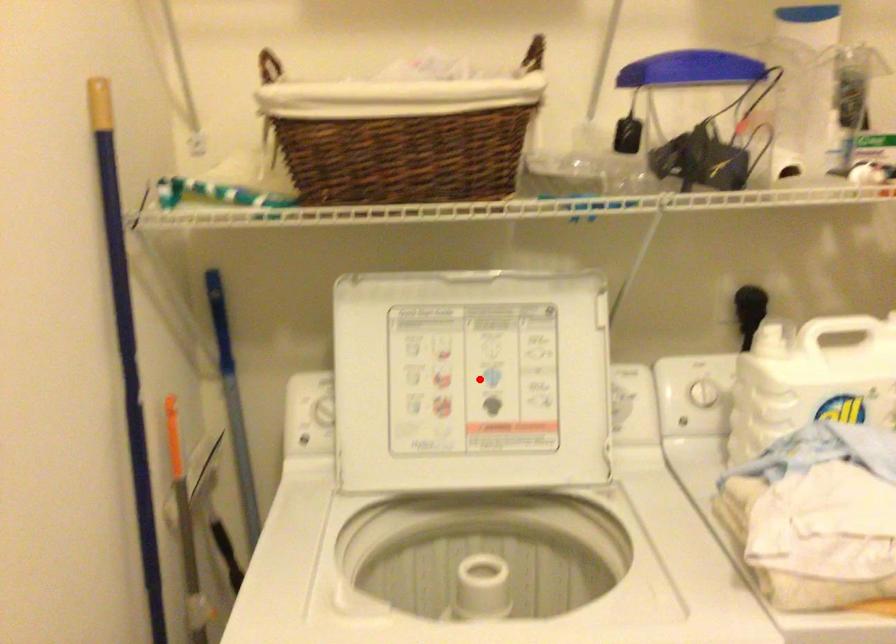
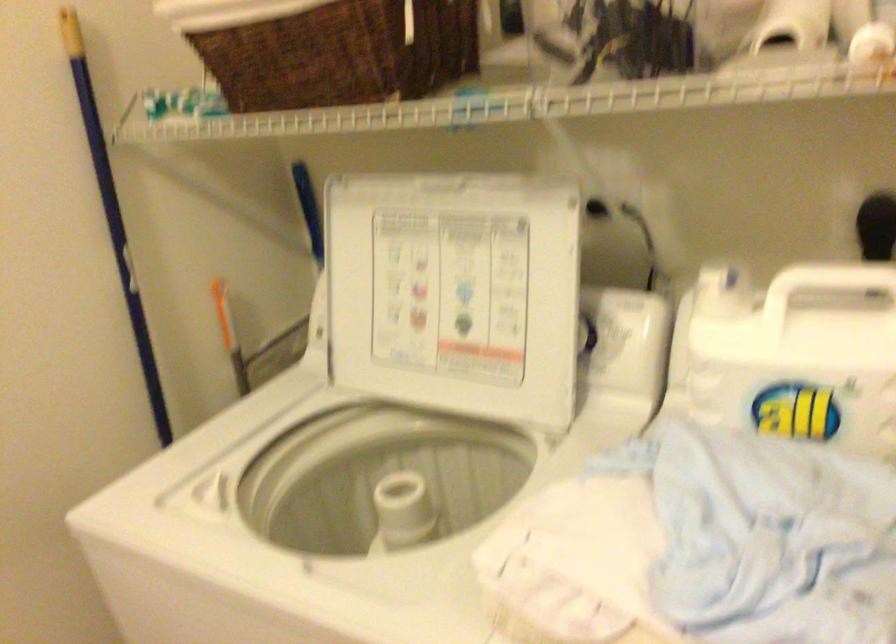
The point at the highlighted location is marked in the first image. Where is the corresponding point in the second image?

(454, 292)